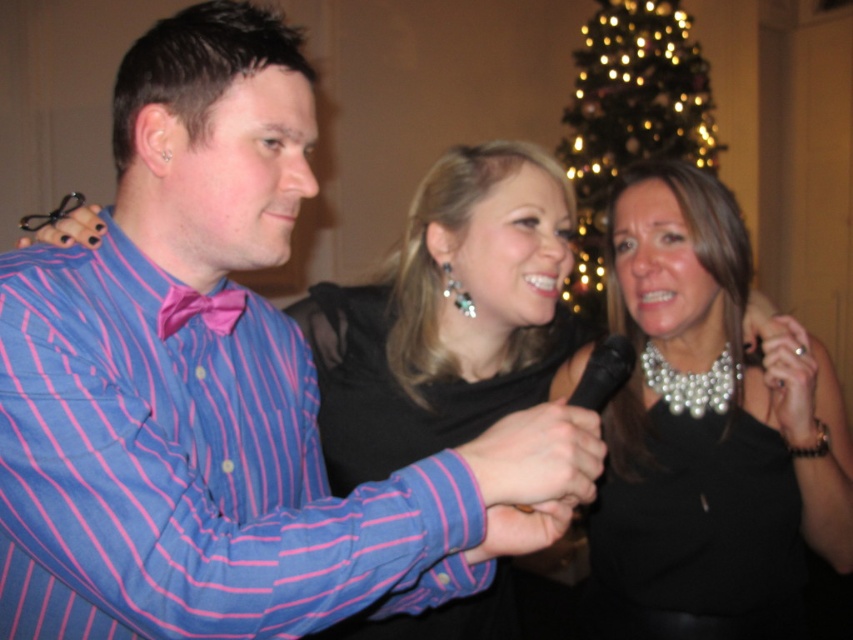
Does point (305, 461) come in front of point (786, 390)?

Yes, point (305, 461) is in front of point (786, 390).

Can you confirm if pink striped shirt at left is bigger than pearl necklace at center?

No, pink striped shirt at left is not bigger than pearl necklace at center.

Which is behind, point (74, 436) or point (701, 422)?

Positioned behind is point (701, 422).

At what (x,y) coordinates should I click in order to perform the action: click on pink striped shirt at left. Please return your answer as a coordinate pair (x, y). The width and height of the screenshot is (853, 640). Looking at the image, I should click on [190, 472].

The width and height of the screenshot is (853, 640). Identify the location of black satin dress at right. coord(698,534).

Does black satin dress at right appear under iridescent glass christmas tree at upper center?

Indeed, black satin dress at right is positioned under iridescent glass christmas tree at upper center.

At what (x,y) coordinates should I click in order to perform the action: click on black satin dress at right. Please return your answer as a coordinate pair (x, y). Looking at the image, I should click on (698, 534).

In order to click on black satin dress at right in this screenshot , I will do `click(698, 534)`.

Which is more to the right, pink striped shirt at left or black satin dress at center?

black satin dress at center is more to the right.

Between point (33, 445) and point (520, 221), which one is positioned in front?

Point (33, 445)

Where is `pink striped shirt at left`? Image resolution: width=853 pixels, height=640 pixels. pink striped shirt at left is located at coordinates (190, 472).